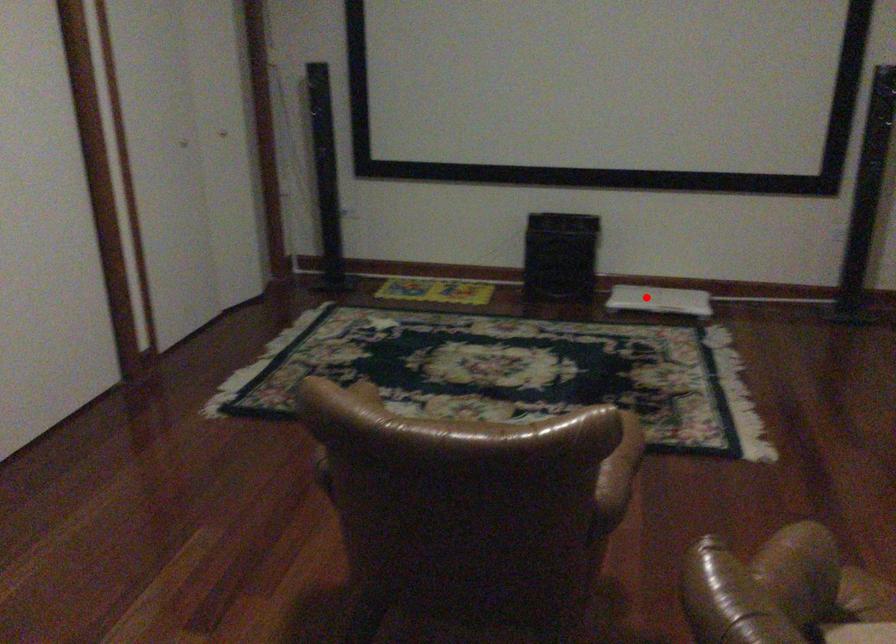
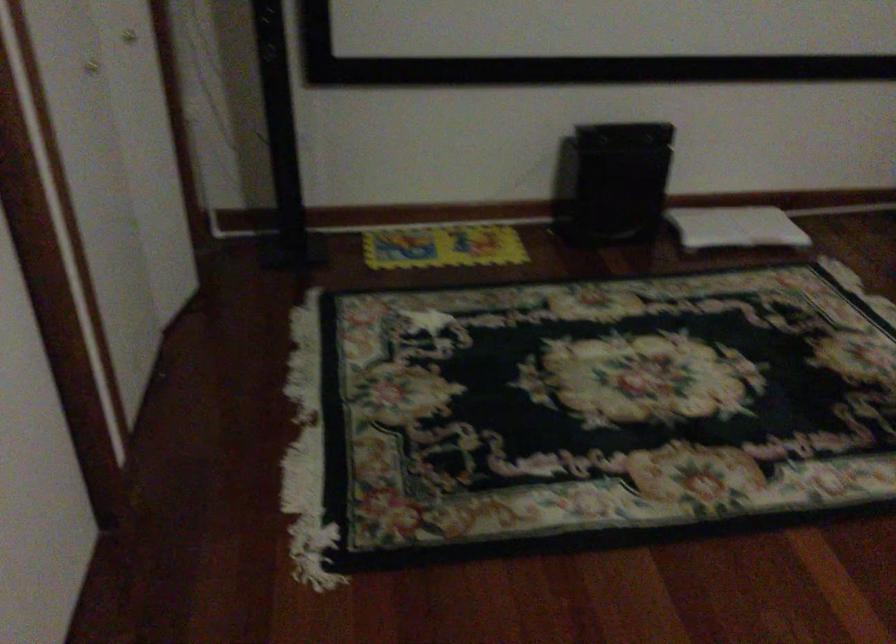
Locate, in the second image, the point that corresponds to the highlighted location in the first image.

(735, 227)